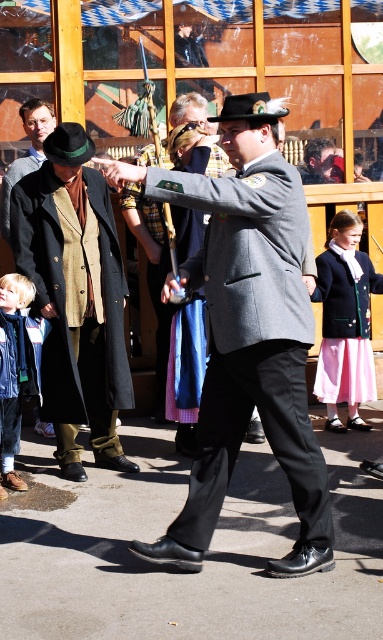
You are standing in the festival crowd and want to move towards the central figure. There are two points in your path marked as point 1 at coordinates point (304,544) and point 2 at coordinates point (317,298). Which point should you walk towards first to reach the central figure more quickly?

You should walk towards point 1 at coordinates point (304,544) first because it is closer to you than point 2 at coordinates point (317,298), so reaching it faster would help you get to the central figure more quickly.

You are a photographer standing near the camera in the scene. You want to capture a closeup shot of the matte gray coat at center. Can you move closer to the coat to take the photo without exceeding the 6.69 meters distance? Please explain your reasoning.

The matte gray coat at center and the camera are 6.69 meters apart. Since you can move closer to the coat, reducing the distance, you can indeed approach within the 6.69 meters to take the closeup shot.